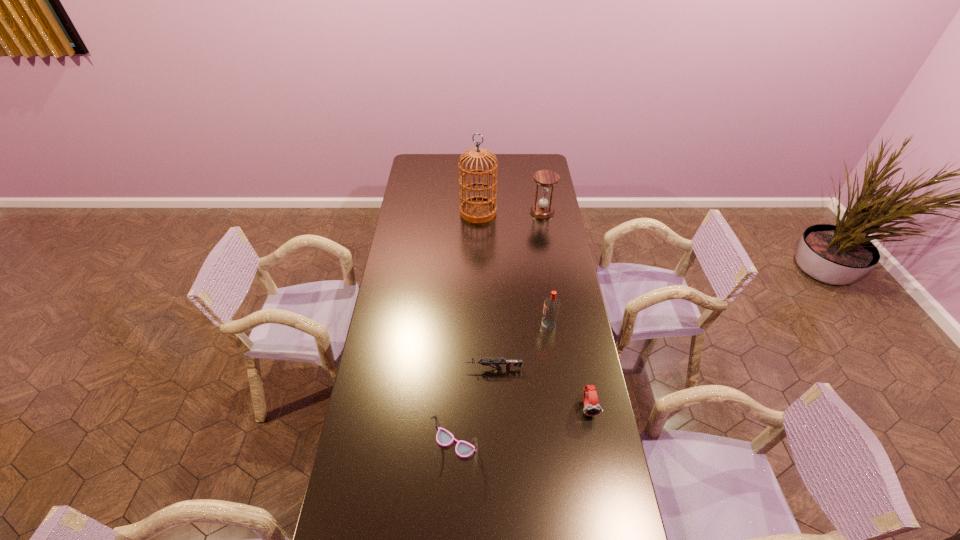
Where is `vacant space located 0.310m on the front of the hourglass`? The image size is (960, 540). vacant space located 0.310m on the front of the hourglass is located at coordinates (550, 261).

Locate an element on the screen. free space located on the front label of the vodka is located at coordinates (453, 326).

This screenshot has height=540, width=960. What are the coordinates of `free space located 0.100m on the front label of the vodka` in the screenshot? It's located at (516, 326).

Where is `free space located on the front label of the vodka`? This screenshot has width=960, height=540. free space located on the front label of the vodka is located at coordinates (495, 326).

I want to click on free space located 0.230m on the right of the spectacles, so click(x=550, y=443).

Image resolution: width=960 pixels, height=540 pixels. I want to click on blank area located 0.160m on the face of the second nearest object, so click(600, 468).

You are a GUI agent. You are given a task and a screenshot of the screen. Output one action in this format:
    pyautogui.click(x=<x>, y=<y>)
    Task: Click on the vacant space situated 0.160m aimed along the barrel of the gun
    
    Given the screenshot: What is the action you would take?
    pyautogui.click(x=420, y=368)

At what (x,y) coordinates should I click in order to perform the action: click on free space located aimed along the barrel of the gun. Please return your answer as a coordinate pair (x, y). This screenshot has height=540, width=960. Looking at the image, I should click on (410, 368).

The width and height of the screenshot is (960, 540). Identify the location of free point located aimed along the barrel of the gun. (448, 368).

The height and width of the screenshot is (540, 960). Find the location of `hourglass located in the right edge section of the desktop`. hourglass located in the right edge section of the desktop is located at coordinates (546, 179).